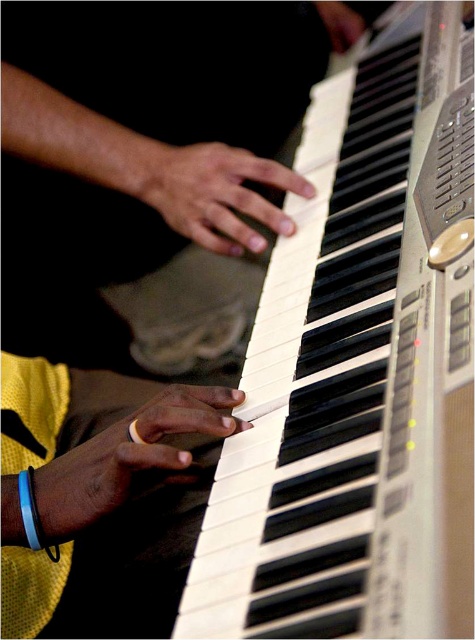
You are a photographer trying to capture the yellow fabric wristband at upper left and the matte black hand at upper right in focus. Which object should you focus on first to ensure both are sharp in the final photo?

You should focus on the yellow fabric wristband at upper left first because it is closer to the camera than the matte black hand at upper right. By focusing on the closer object, you can ensure that both will be in focus if they are within the depth of field.

In the scene shown: You are a photographer trying to capture the musician playing the keyboard. You want to ensure that both the yellow fabric wristband at upper left and the smooth skin hand at center are clearly visible in your photo. Based on their positions, which object should you focus on first to ensure both are in frame?

The yellow fabric wristband at upper left is to the left of the smooth skin hand at center. To ensure both are in frame, focus on the yellow fabric wristband at upper left first, then adjust to include the smooth skin hand at center.

You are a photographer adjusting the lighting for a closeup shot of a keyboard player. You notice the yellow fabric wristband at upper left and the matte black hand at upper right. Which object has a greater width in the frame?

The yellow fabric wristband at upper left has a greater width than the matte black hand at upper right.